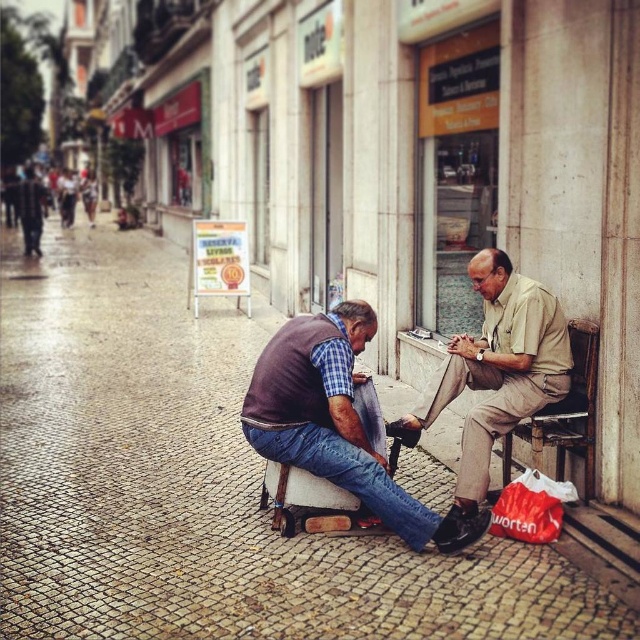
Is cobblestone pavement at center behind beige cotton shirt at center?

No.

Does cobblestone pavement at center have a smaller size compared to beige cotton shirt at center?

Incorrect, cobblestone pavement at center is not smaller in size than beige cotton shirt at center.

Identify the location of cobblestone pavement at center. The height and width of the screenshot is (640, 640). (200, 483).

At what (x,y) coordinates should I click in order to perform the action: click on cobblestone pavement at center. Please return your answer as a coordinate pair (x, y). This screenshot has width=640, height=640. Looking at the image, I should click on (x=200, y=483).

Is cobblestone pavement at center below brown leather shoe at lower center?

No.

Is cobblestone pavement at center thinner than brown leather shoe at lower center?

No, cobblestone pavement at center is not thinner than brown leather shoe at lower center.

Identify the location of cobblestone pavement at center. Image resolution: width=640 pixels, height=640 pixels. (200, 483).

Between brown leather shoe at lower center and beige cotton shirt at center, which one appears on the left side from the viewer's perspective?

From the viewer's perspective, brown leather shoe at lower center appears more on the left side.

Is brown leather shoe at lower center bigger than beige cotton shirt at center?

Actually, brown leather shoe at lower center might be smaller than beige cotton shirt at center.

What do you see at coordinates (337, 420) in the screenshot? I see `brown leather shoe at lower center` at bounding box center [337, 420].

In order to click on brown leather shoe at lower center in this screenshot , I will do `click(337, 420)`.